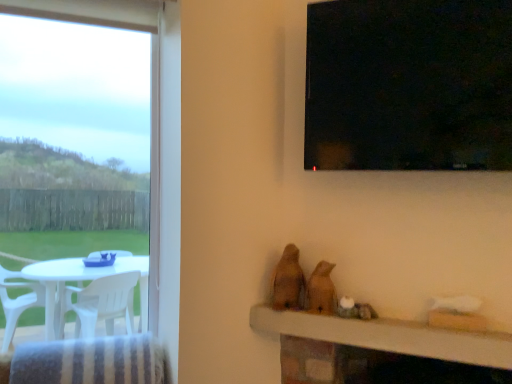
Identify the location of vacant area on top of wooden table at lower center (from a real-world perspective). The width and height of the screenshot is (512, 384). (378, 311).